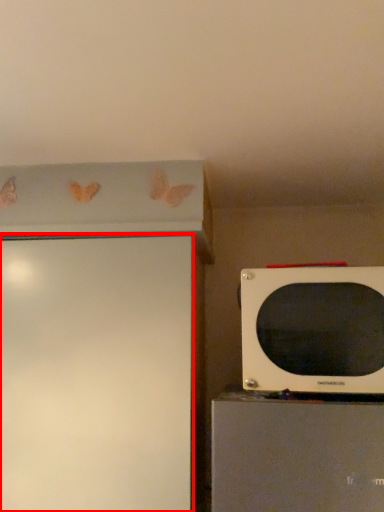
Question: Where is screen door (annotated by the red box) located in relation to microwave oven in the image?

Choices:
 (A) right
 (B) left

Answer: (B)